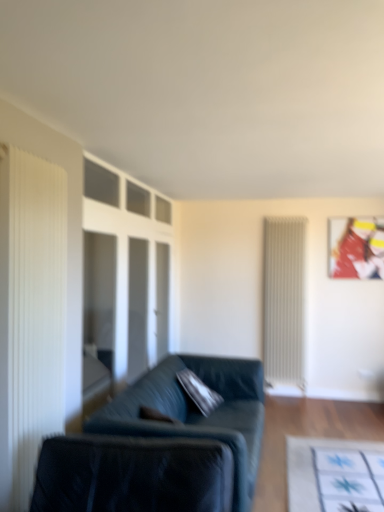
Question: Considering the relative sizes of metallic glossy picture frame at upper right and white pleated curtain at left in the image provided, is metallic glossy picture frame at upper right taller than white pleated curtain at left?

Choices:
 (A) no
 (B) yes

Answer: (A)

Question: Considering the relative sizes of metallic glossy picture frame at upper right and white pleated curtain at left in the image provided, is metallic glossy picture frame at upper right smaller than white pleated curtain at left?

Choices:
 (A) no
 (B) yes

Answer: (B)

Question: From a real-world perspective, does metallic glossy picture frame at upper right sit lower than white pleated curtain at left?

Choices:
 (A) yes
 (B) no

Answer: (B)

Question: Is metallic glossy picture frame at upper right oriented away from white pleated curtain at left?

Choices:
 (A) yes
 (B) no

Answer: (B)

Question: Considering the relative sizes of metallic glossy picture frame at upper right and white pleated curtain at left in the image provided, is metallic glossy picture frame at upper right bigger than white pleated curtain at left?

Choices:
 (A) no
 (B) yes

Answer: (A)

Question: In terms of height, does white pleated curtain at left look taller or shorter compared to white ribbed radiator at right?

Choices:
 (A) tall
 (B) short

Answer: (B)

Question: Looking at the image, does white pleated curtain at left seem bigger or smaller compared to white ribbed radiator at right?

Choices:
 (A) small
 (B) big

Answer: (A)

Question: From the image's perspective, is white pleated curtain at left located above or below white ribbed radiator at right?

Choices:
 (A) above
 (B) below

Answer: (A)

Question: Is point (3, 202) positioned closer to the camera than point (297, 321)?

Choices:
 (A) farther
 (B) closer

Answer: (B)

Question: Based on their sizes in the image, would you say metallic glossy picture frame at upper right is bigger or smaller than white pleated curtain at left?

Choices:
 (A) small
 (B) big

Answer: (A)

Question: Considering the positions of metallic glossy picture frame at upper right and white pleated curtain at left in the image, is metallic glossy picture frame at upper right taller or shorter than white pleated curtain at left?

Choices:
 (A) short
 (B) tall

Answer: (A)

Question: From the image's perspective, relative to white pleated curtain at left, is metallic glossy picture frame at upper right above or below?

Choices:
 (A) above
 (B) below

Answer: (A)

Question: Is metallic glossy picture frame at upper right situated inside white pleated curtain at left or outside?

Choices:
 (A) inside
 (B) outside

Answer: (B)

Question: Considering their positions, is white pleated curtain at left located in front of or behind transparent glass door at center?

Choices:
 (A) behind
 (B) front

Answer: (B)

Question: Is white pleated curtain at left to the left or to the right of transparent glass door at center in the image?

Choices:
 (A) right
 (B) left

Answer: (B)